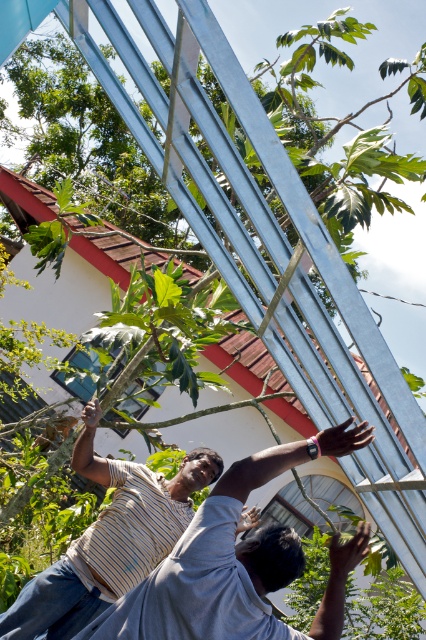
Question: Can you confirm if striped cotton shirt at center is positioned to the right of striped fabric at lower center?

Choices:
 (A) no
 (B) yes

Answer: (B)

Question: Can you confirm if striped cotton shirt at center is bigger than striped fabric at lower center?

Choices:
 (A) yes
 (B) no

Answer: (B)

Question: Can you confirm if striped cotton shirt at center is bigger than striped fabric at lower center?

Choices:
 (A) yes
 (B) no

Answer: (B)